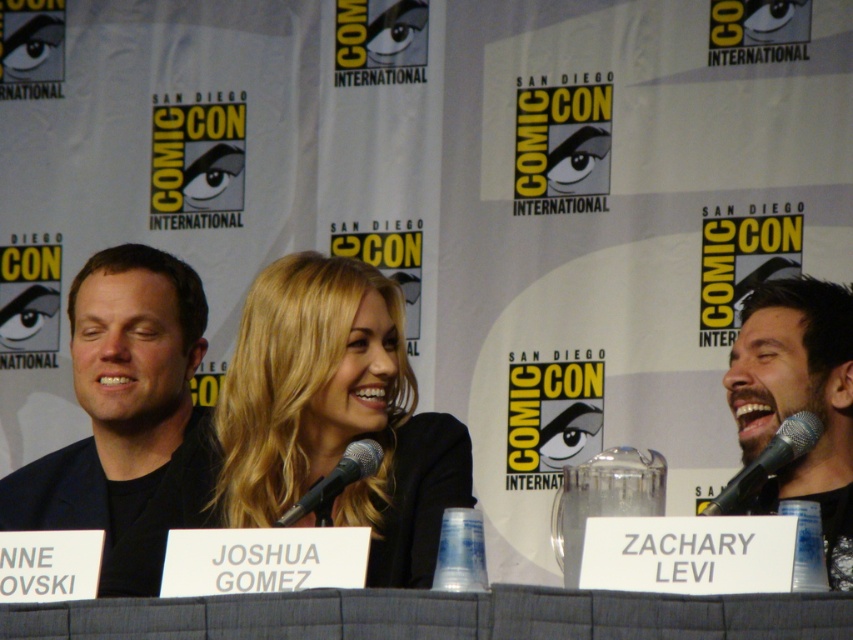
Based on the photo, you are attending Comic Con and want to take a photo with the person wearing the black matte suit at left. Where should you position yourself to ensure the person is in the frame?

The black matte suit at left is located at point (128, 419), so you should position yourself to the left side of the scene to capture the person in your photo.

You are a photographer at Comic Con. You need to take a group photo of the black matte suit at left and the black matte beard at right. Which object should you place closer to the camera to ensure both are in focus?

The black matte suit at left is much taller than the black matte beard at right, so you should place the black matte beard at right closer to the camera to ensure both are in focus.

You are standing at the entrance of the Comic Con panel discussion room. You want to take a photo of the point at coordinate point (x=838, y=412). The camera you are using has a maximum focus range of 20 meters. Will the camera be able to focus on that point?

The distance of point (x=838, y=412) from the camera is 22.94 meters, which exceeds the camera maximum focus range of 20 meters. Therefore, the camera will not be able to focus on that point.